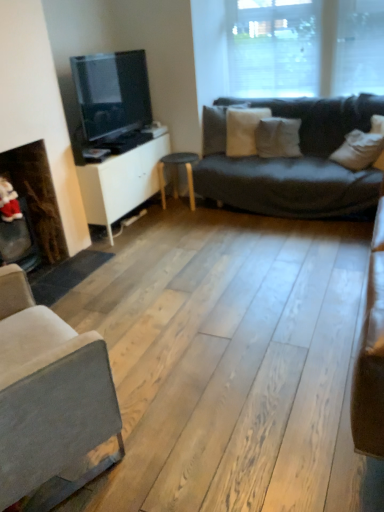
Question: From the image's perspective, does matte black stool at center appear lower than white matte cabinet at center?

Choices:
 (A) yes
 (B) no

Answer: (B)

Question: Is matte black stool at center not near white matte cabinet at center?

Choices:
 (A) yes
 (B) no

Answer: (B)

Question: Is white matte cabinet at center at the back of matte black stool at center?

Choices:
 (A) no
 (B) yes

Answer: (A)

Question: Is matte black stool at center in front of white matte cabinet at center?

Choices:
 (A) yes
 (B) no

Answer: (B)

Question: Considering the relative sizes of matte black stool at center and white matte cabinet at center in the image provided, is matte black stool at center shorter than white matte cabinet at center?

Choices:
 (A) no
 (B) yes

Answer: (B)

Question: From the image's perspective, is light gray fabric couch at lower left located above or below matte black tv at left?

Choices:
 (A) above
 (B) below

Answer: (B)

Question: Is light gray fabric couch at lower left situated inside matte black tv at left or outside?

Choices:
 (A) inside
 (B) outside

Answer: (B)

Question: From a real-world perspective, relative to matte black tv at left, is light gray fabric couch at lower left vertically above or below?

Choices:
 (A) below
 (B) above

Answer: (A)

Question: Does point (31, 488) appear closer or farther from the camera than point (107, 115)?

Choices:
 (A) farther
 (B) closer

Answer: (B)

Question: Considering the positions of matte black stool at center and matte black tv at left in the image, is matte black stool at center wider or thinner than matte black tv at left?

Choices:
 (A) wide
 (B) thin

Answer: (A)

Question: From a real-world perspective, relative to matte black tv at left, is matte black stool at center vertically above or below?

Choices:
 (A) above
 (B) below

Answer: (B)

Question: From their relative heights in the image, would you say matte black stool at center is taller or shorter than matte black tv at left?

Choices:
 (A) short
 (B) tall

Answer: (A)

Question: Considering the positions of point (173, 169) and point (110, 75), is point (173, 169) closer or farther from the camera than point (110, 75)?

Choices:
 (A) closer
 (B) farther

Answer: (B)

Question: From the image's perspective, is matte black tv at left positioned above or below dark brown wood fireplace at left?

Choices:
 (A) below
 (B) above

Answer: (B)

Question: Does point (102, 108) appear closer or farther from the camera than point (33, 189)?

Choices:
 (A) closer
 (B) farther

Answer: (B)